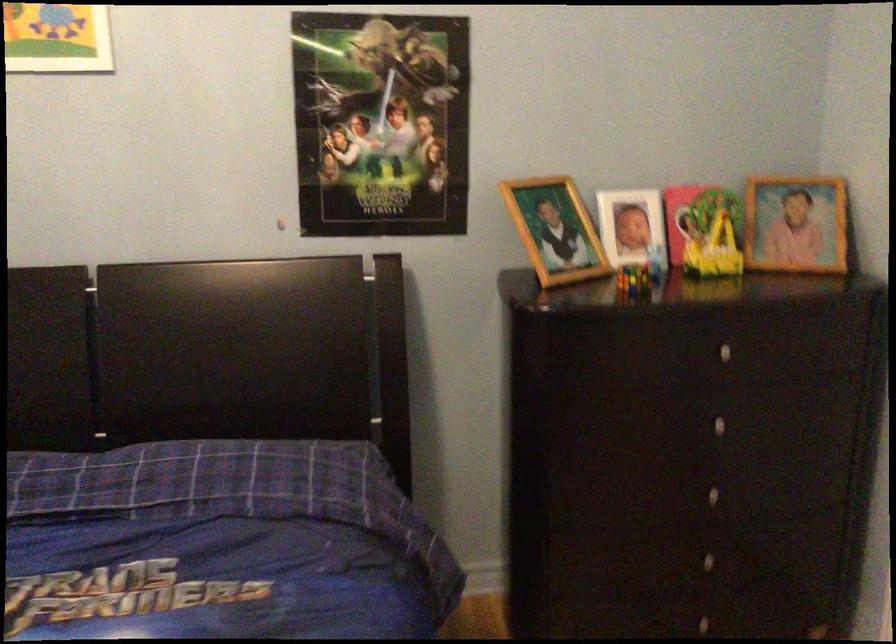
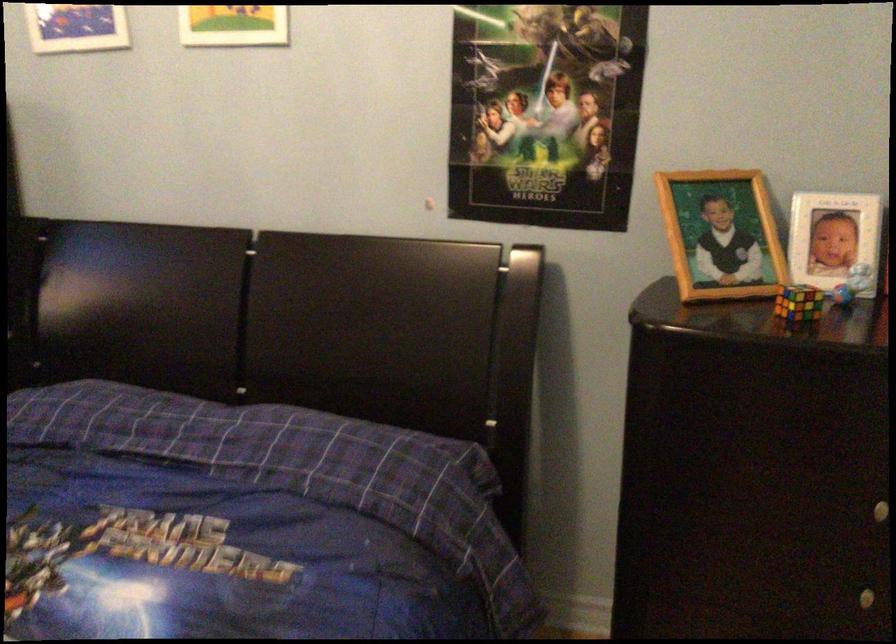
The point at [634,272] is marked in the first image. Where is the corresponding point in the second image?

(798, 303)